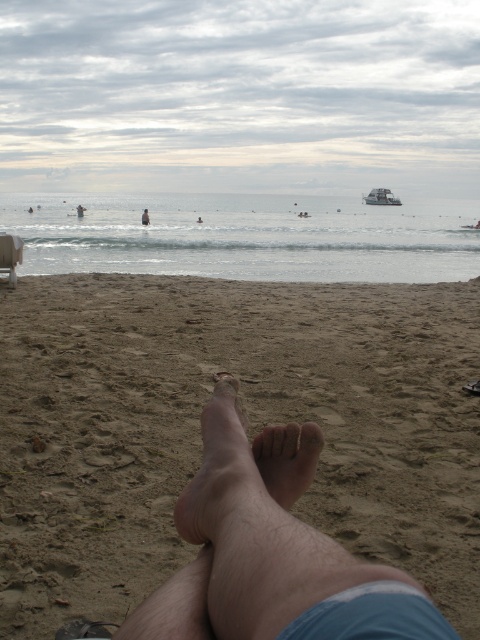
Between brown sandy beach at lower center and pale skin foot at lower center, which one appears on the right side from the viewer's perspective?

brown sandy beach at lower center

Does brown sandy beach at lower center appear over pale skin foot at lower center?

No.

Locate an element on the screen. The width and height of the screenshot is (480, 640). brown sandy beach at lower center is located at coordinates click(x=249, y=428).

Is point (291, 472) more distant than point (305, 442)?

Yes, it is.

Locate an element on the screen. dry skin at center is located at coordinates (288, 460).

Describe the element at coordinates (311, 435) in the screenshot. I see `brown rough toe at center` at that location.

Is brown rough toe at center to the left of skinny person at lower center from the viewer's perspective?

Incorrect, brown rough toe at center is not on the left side of skinny person at lower center.

The height and width of the screenshot is (640, 480). What do you see at coordinates (311, 435) in the screenshot?
I see `brown rough toe at center` at bounding box center [311, 435].

Locate an element on the screen. brown rough toe at center is located at coordinates (311, 435).